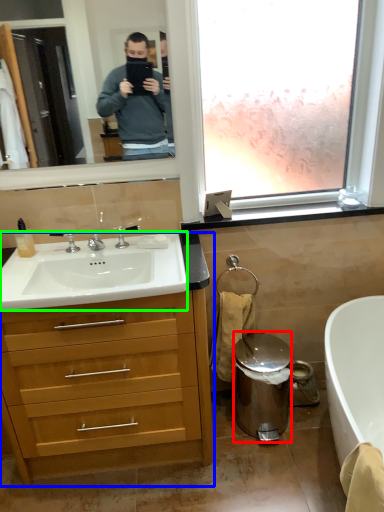
Question: Estimate the real-world distances between objects in this image. Which object is farther from trash bin/can (highlighted by a red box), cabinetry (highlighted by a blue box) or sink (highlighted by a green box)?

Choices:
 (A) cabinetry
 (B) sink

Answer: (B)